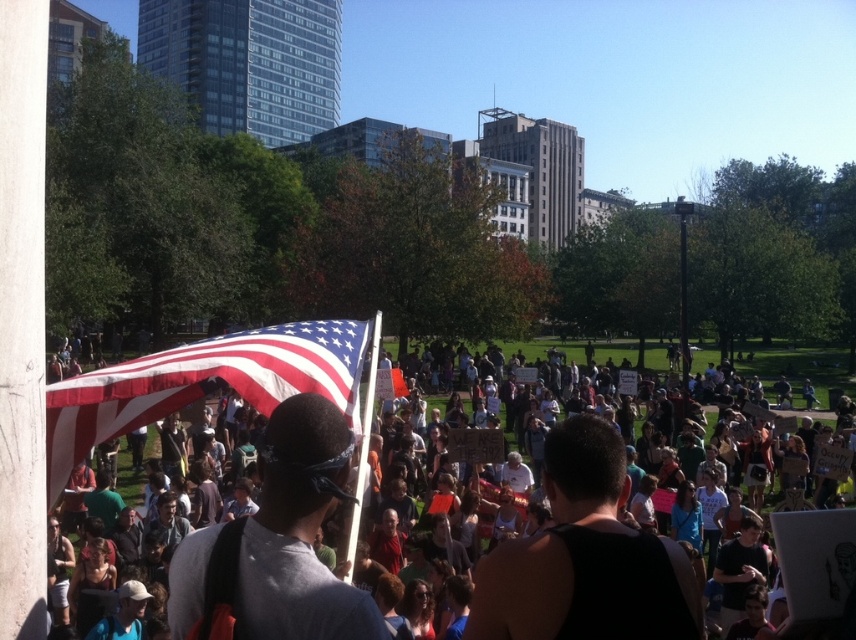
Question: Is american flag at center smaller than white tank top at center?

Choices:
 (A) yes
 (B) no

Answer: (A)

Question: Which point is closer to the camera?

Choices:
 (A) white tank top at center
 (B) american flag at center

Answer: (B)

Question: Can you confirm if american flag at center is positioned to the left of white tank top at center?

Choices:
 (A) no
 (B) yes

Answer: (B)

Question: Which point is farther from the camera taking this photo?

Choices:
 (A) (807, 444)
 (B) (137, 376)

Answer: (A)

Question: Is american flag at center wider than white tank top at center?

Choices:
 (A) no
 (B) yes

Answer: (A)